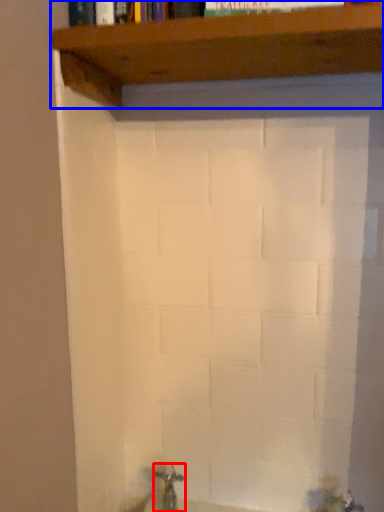
Question: Among these objects, which one is farthest to the camera, tap (highlighted by a red box) or shelf (highlighted by a blue box)?

Choices:
 (A) tap
 (B) shelf

Answer: (A)